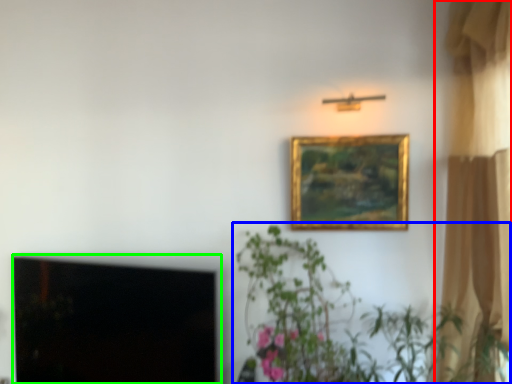
Question: Which object is the farthest from curtain (highlighted by a red box)? Choose among these: houseplant (highlighted by a blue box) or window screen (highlighted by a green box).

Choices:
 (A) houseplant
 (B) window screen

Answer: (B)